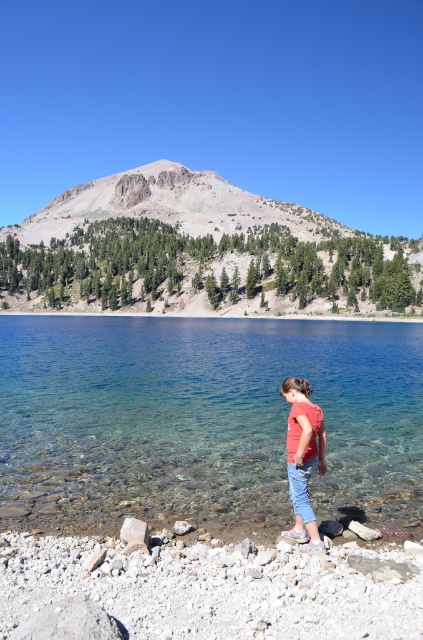
From the picture: Is clear glass water at center further to camera compared to red cotton shirt at center?

Yes.

What do you see at coordinates (203, 419) in the screenshot? I see `clear glass water at center` at bounding box center [203, 419].

This screenshot has width=423, height=640. Find the location of `clear glass water at center`. clear glass water at center is located at coordinates point(203,419).